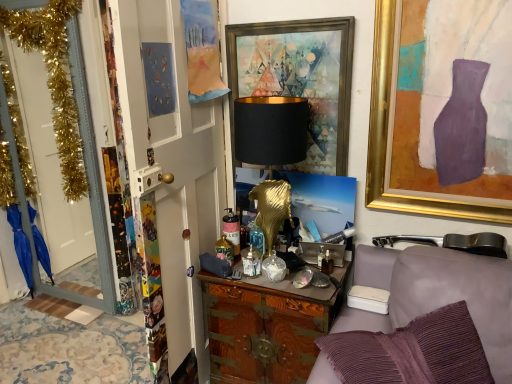
Question: Is white glossy door at left, which is the 2th door from front to back, wider than black matte/golden base at center?

Choices:
 (A) yes
 (B) no

Answer: (B)

Question: From a real-world perspective, is white glossy door at left, which is the 1th door in back-to-front order, on black matte/golden base at center?

Choices:
 (A) yes
 (B) no

Answer: (B)

Question: Does white glossy door at left, marked as the 2th door in a right-to-left arrangement, lie in front of black matte/golden base at center?

Choices:
 (A) no
 (B) yes

Answer: (A)

Question: Is white glossy door at left, acting as the 1th door starting from the left, facing towards black matte/golden base at center?

Choices:
 (A) no
 (B) yes

Answer: (A)

Question: Is white glossy door at left, which is the 1th door in back-to-front order, to the left of black matte/golden base at center from the viewer's perspective?

Choices:
 (A) no
 (B) yes

Answer: (B)

Question: From a real-world perspective, is black matte/golden base at center physically located above or below gold-framed painting at upper right, which is the 1th picture frame from right to left?

Choices:
 (A) below
 (B) above

Answer: (A)

Question: Is black matte/golden base at center inside the boundaries of gold-framed painting at upper right, which ranks as the second picture frame in left-to-right order, or outside?

Choices:
 (A) outside
 (B) inside

Answer: (A)

Question: Relative to gold-framed painting at upper right, which ranks as the second picture frame in left-to-right order, is black matte/golden base at center in front or behind?

Choices:
 (A) behind
 (B) front

Answer: (A)

Question: In terms of size, does black matte/golden base at center appear bigger or smaller than gold-framed painting at upper right, which is the 1th picture frame from right to left?

Choices:
 (A) small
 (B) big

Answer: (B)

Question: In the image, is gold-framed painting at upper right, which ranks as the second picture frame in left-to-right order, on the left side or the right side of white fabric armchair at lower right?

Choices:
 (A) left
 (B) right

Answer: (B)

Question: Considering the positions of gold-framed painting at upper right, which ranks as the second picture frame in left-to-right order, and white fabric armchair at lower right in the image, is gold-framed painting at upper right, which ranks as the second picture frame in left-to-right order, wider or thinner than white fabric armchair at lower right?

Choices:
 (A) thin
 (B) wide

Answer: (A)

Question: Based on their sizes in the image, would you say gold-framed painting at upper right, which is the 1th picture frame from right to left, is bigger or smaller than white fabric armchair at lower right?

Choices:
 (A) small
 (B) big

Answer: (A)

Question: Considering the positions of point (384, 41) and point (347, 327), is point (384, 41) closer or farther from the camera than point (347, 327)?

Choices:
 (A) farther
 (B) closer

Answer: (B)

Question: Which is correct: white fabric armchair at lower right is inside wooden cabinet at center, or outside of it?

Choices:
 (A) outside
 (B) inside

Answer: (A)

Question: Considering the positions of white fabric armchair at lower right and wooden cabinet at center in the image, is white fabric armchair at lower right taller or shorter than wooden cabinet at center?

Choices:
 (A) short
 (B) tall

Answer: (A)